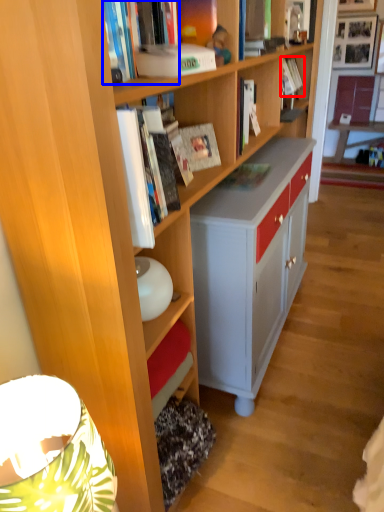
Question: Among these objects, which one is nearest to the camera, book (highlighted by a red box) or book (highlighted by a blue box)?

Choices:
 (A) book
 (B) book

Answer: (B)